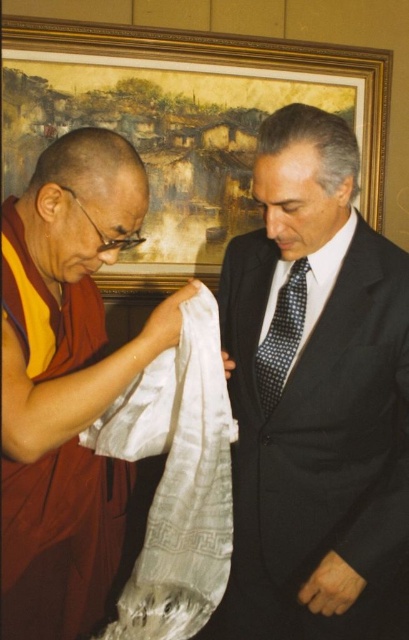
Question: Can you confirm if silky white cloth at center is positioned above matte silk scarf at left?

Choices:
 (A) yes
 (B) no

Answer: (B)

Question: Which of these objects is positioned closest to the matte silk scarf at left?

Choices:
 (A) silky white cloth at center
 (B) white silk cloth at center
 (C) gold-framed painting at upper center
 (D) polka dot silk tie at center

Answer: (B)

Question: Which point is closer to the camera?

Choices:
 (A) gold-framed painting at upper center
 (B) white silk cloth at center

Answer: (B)

Question: Can you confirm if silky white cloth at center is bigger than matte silk scarf at left?

Choices:
 (A) no
 (B) yes

Answer: (B)

Question: Which object appears farthest from the camera in this image?

Choices:
 (A) silky white cloth at center
 (B) gold-framed painting at upper center

Answer: (B)

Question: Does silky white cloth at center have a larger size compared to white silk cloth at center?

Choices:
 (A) yes
 (B) no

Answer: (A)